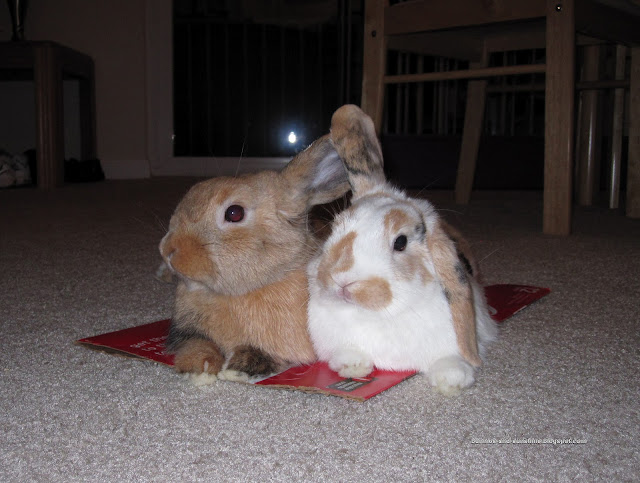
This screenshot has height=483, width=640. Identify the location of chair legs. (377, 99), (473, 106), (560, 127).